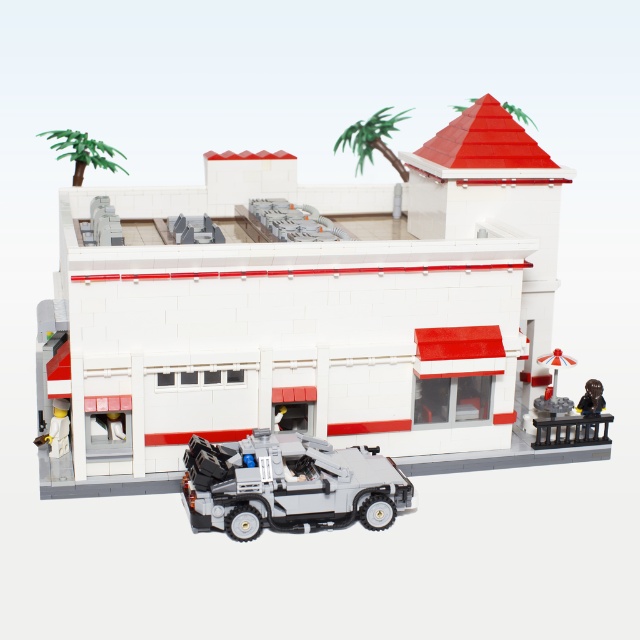
You are standing at the origin point in a LEGO model scene. The white matte building at center is positioned at coordinates approximately 0.487 on the x and 0.480 on the y. If you want to walk directly towards the building from your current position, which direction should you head?

Since the white matte building at center is located at coordinates approximately 0.487 on the x and 0.480 on the y, you should head northeast to reach it directly from the origin point.

You are a tiny LEGO person standing on the roof of the diner. You look towards the upper part of the image and see both the green leafy palm tree at upper center and the green plastic palm tree at upper left. Which one is closer to you?

The green leafy palm tree at upper center is closer to you because it is positioned over the green plastic palm tree at upper left.